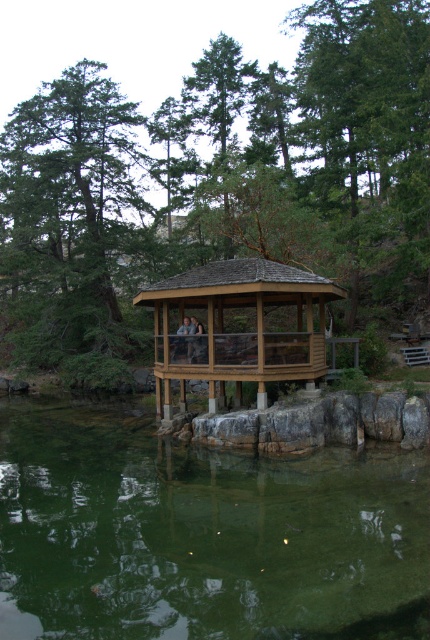
You are planning to place a small wooden boat in the water near the green textured tree at center. Based on the scene, can the green translucent water at lower center accommodate the boat if it requires a width of 2 meters?

The green translucent water at lower center might be wider than the green textured tree at center. Since the tree is positioned at the center, the water could provide sufficient width for the boat requiring 2 meters.